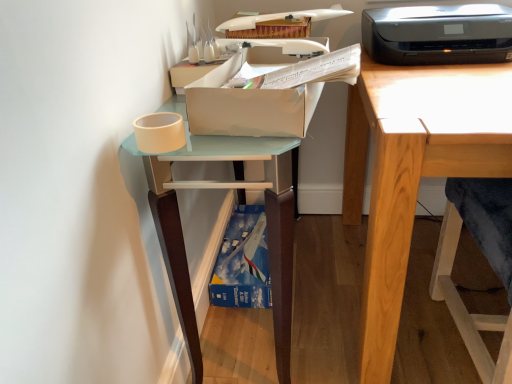
Question: Is cardboard box at upper center next to black plastic printer at upper right?

Choices:
 (A) no
 (B) yes

Answer: (A)

Question: From the image's perspective, would you say cardboard box at upper center is shown under black plastic printer at upper right?

Choices:
 (A) yes
 (B) no

Answer: (A)

Question: Could you tell me if cardboard box at upper center is facing black plastic printer at upper right?

Choices:
 (A) yes
 (B) no

Answer: (B)

Question: From a real-world perspective, is cardboard box at upper center beneath black plastic printer at upper right?

Choices:
 (A) yes
 (B) no

Answer: (A)

Question: Is cardboard box at upper center far away from black plastic printer at upper right?

Choices:
 (A) yes
 (B) no

Answer: (B)

Question: Considering the relative positions of cardboard box at upper center and black plastic printer at upper right in the image provided, is cardboard box at upper center to the left of black plastic printer at upper right from the viewer's perspective?

Choices:
 (A) no
 (B) yes

Answer: (B)

Question: Is wooden desk at right facing away from black plastic printer at upper right?

Choices:
 (A) yes
 (B) no

Answer: (B)

Question: From a real-world perspective, is wooden desk at right over black plastic printer at upper right?

Choices:
 (A) no
 (B) yes

Answer: (A)

Question: From the image's perspective, would you say wooden desk at right is shown under black plastic printer at upper right?

Choices:
 (A) no
 (B) yes

Answer: (B)

Question: Is wooden desk at right shorter than black plastic printer at upper right?

Choices:
 (A) yes
 (B) no

Answer: (B)

Question: From the image's perspective, does wooden desk at right appear higher than black plastic printer at upper right?

Choices:
 (A) no
 (B) yes

Answer: (A)

Question: From a real-world perspective, is wooden desk at right beneath black plastic printer at upper right?

Choices:
 (A) no
 (B) yes

Answer: (B)

Question: Can you confirm if black plastic printer at upper right is wider than matte white shelf at left?

Choices:
 (A) yes
 (B) no

Answer: (A)